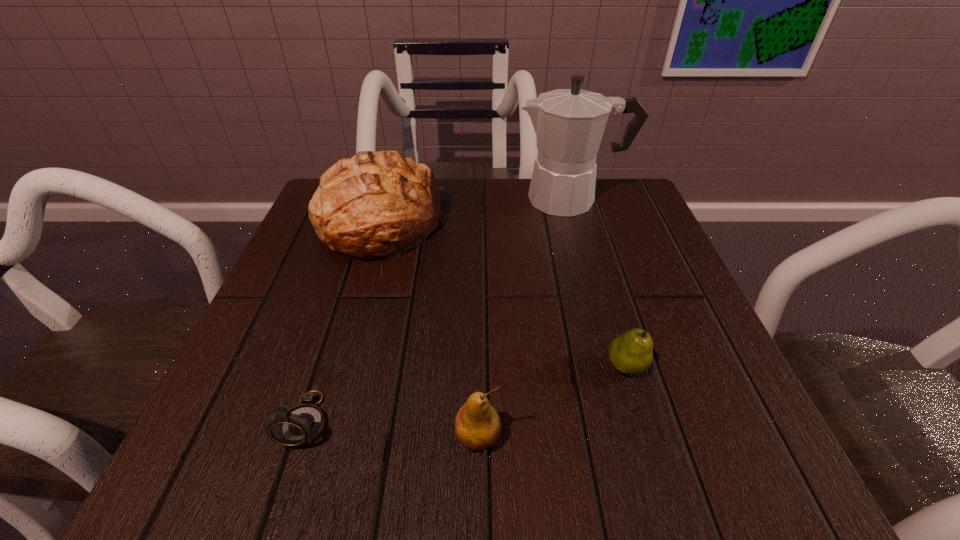
The width and height of the screenshot is (960, 540). What are the coordinates of `pear located at the right edge` in the screenshot? It's located at (631, 353).

Locate an element on the screen. The image size is (960, 540). object located in the far left corner section of the desktop is located at coordinates (375, 205).

You are a GUI agent. You are given a task and a screenshot of the screen. Output one action in this format:
    pyautogui.click(x=<x>, y=<y>)
    Task: Click on the object that is at the near left corner
    
    Given the screenshot: What is the action you would take?
    pyautogui.click(x=302, y=424)

Find the location of a particular element. This screenshot has height=540, width=960. object present at the far right corner is located at coordinates (569, 124).

Where is `free space at the far edge`? This screenshot has height=540, width=960. free space at the far edge is located at coordinates (508, 221).

You are a GUI agent. You are given a task and a screenshot of the screen. Output one action in this format:
    pyautogui.click(x=<x>, y=<y>)
    Task: Click on the vacant area at the near edge of the desktop
    Image resolution: width=960 pixels, height=540 pixels.
    Given the screenshot: What is the action you would take?
    [375, 452]

At what (x,y) coordinates should I click in order to perform the action: click on blank space at the left edge. Please return your answer as a coordinate pair (x, y). The image size is (960, 540). Looking at the image, I should click on (269, 340).

What are the coordinates of `free location at the right edge` in the screenshot? It's located at (669, 249).

The width and height of the screenshot is (960, 540). I want to click on free space at the near left corner, so click(287, 450).

At what (x,y) coordinates should I click in order to perform the action: click on vacant position at the near right corner of the desktop. Please return your answer as a coordinate pair (x, y). Looking at the image, I should click on (664, 474).